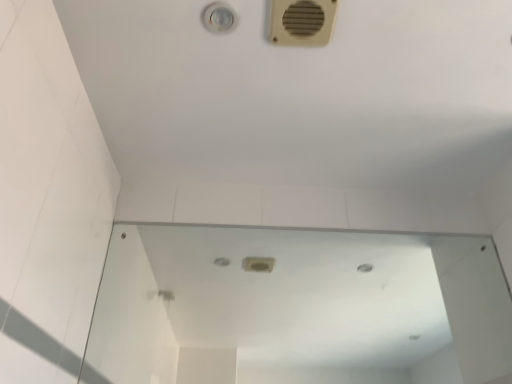
Question: Is point (286, 322) closer or farther from the camera than point (302, 1)?

Choices:
 (A) farther
 (B) closer

Answer: (A)

Question: Is transparent glass mirror at center taller or shorter than beige plastic air conditioning at upper right?

Choices:
 (A) short
 (B) tall

Answer: (B)

Question: Is transparent glass mirror at center to the left or to the right of beige plastic air conditioning at upper right in the image?

Choices:
 (A) left
 (B) right

Answer: (B)

Question: Is point (301, 16) closer or farther from the camera than point (428, 369)?

Choices:
 (A) farther
 (B) closer

Answer: (B)

Question: Considering the positions of beige plastic air conditioning at upper right and transparent glass mirror at center in the image, is beige plastic air conditioning at upper right bigger or smaller than transparent glass mirror at center?

Choices:
 (A) big
 (B) small

Answer: (B)

Question: From a real-world perspective, is beige plastic air conditioning at upper right positioned above or below transparent glass mirror at center?

Choices:
 (A) above
 (B) below

Answer: (A)

Question: From the image's perspective, is beige plastic air conditioning at upper right located above or below transparent glass mirror at center?

Choices:
 (A) above
 (B) below

Answer: (A)